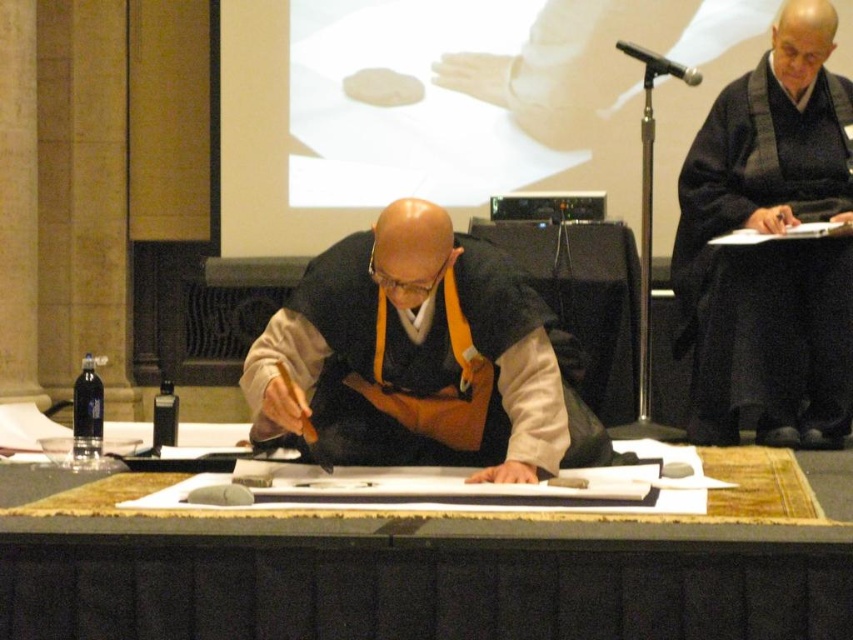
Question: Which of these objects is positioned farthest from the wooden table at center?

Choices:
 (A) matte black robe at center
 (B) black matte robe at upper right

Answer: (B)

Question: Which point is farther from the camera taking this photo?

Choices:
 (A) (840, 586)
 (B) (750, 330)

Answer: (B)

Question: Does matte black robe at center lie behind black matte robe at upper right?

Choices:
 (A) yes
 (B) no

Answer: (B)

Question: Can you confirm if wooden table at center is positioned below black matte robe at upper right?

Choices:
 (A) yes
 (B) no

Answer: (A)

Question: Which of these objects is positioned closest to the black matte robe at upper right?

Choices:
 (A) matte black robe at center
 (B) wooden table at center

Answer: (A)

Question: Is matte black robe at center above black matte robe at upper right?

Choices:
 (A) no
 (B) yes

Answer: (A)